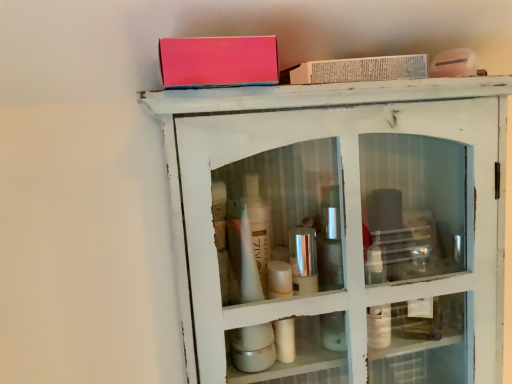
Question: In which direction should I rotate to look at matte pink box at upper center, which is the 2th book in back-to-front order?

Choices:
 (A) right
 (B) left

Answer: (B)

Question: Is matte pink box at upper center, which is the 2th book in back-to-front order, aimed at white distressed cabinet at upper center?

Choices:
 (A) yes
 (B) no

Answer: (B)

Question: Is matte pink box at upper center, which is the 2th book in back-to-front order, to the right of white distressed cabinet at upper center from the viewer's perspective?

Choices:
 (A) yes
 (B) no

Answer: (B)

Question: Is matte pink box at upper center, the 2th book viewed from the right, taller than white distressed cabinet at upper center?

Choices:
 (A) yes
 (B) no

Answer: (B)

Question: Is matte pink box at upper center, which is the 2th book in back-to-front order, wider than white distressed cabinet at upper center?

Choices:
 (A) no
 (B) yes

Answer: (A)

Question: Is matte pink box at upper center, positioned as the first book in front-to-back order, thinner than white distressed cabinet at upper center?

Choices:
 (A) no
 (B) yes

Answer: (B)

Question: Is matte pink box at upper center, positioned as the first book in front-to-back order, located outside white distressed cabinet at upper center?

Choices:
 (A) no
 (B) yes

Answer: (B)

Question: From the image's perspective, is white distressed cabinet at upper center beneath white paper book at upper center, positioned as the 2th book in front-to-back order?

Choices:
 (A) no
 (B) yes

Answer: (B)

Question: Can you confirm if white distressed cabinet at upper center is positioned to the left of white paper book at upper center, acting as the second book starting from the left?

Choices:
 (A) no
 (B) yes

Answer: (B)

Question: Is white distressed cabinet at upper center in front of white paper book at upper center, the 1th book viewed from the back?

Choices:
 (A) no
 (B) yes

Answer: (B)

Question: Is white distressed cabinet at upper center shorter than white paper book at upper center, acting as the second book starting from the left?

Choices:
 (A) no
 (B) yes

Answer: (A)

Question: From a real-world perspective, is white distressed cabinet at upper center physically below white paper book at upper center, the 1th book viewed from the back?

Choices:
 (A) no
 (B) yes

Answer: (B)

Question: Considering the relative sizes of white distressed cabinet at upper center and white paper book at upper center, the 1th book positioned from the right, in the image provided, is white distressed cabinet at upper center smaller than white paper book at upper center, the 1th book positioned from the right,?

Choices:
 (A) yes
 (B) no

Answer: (B)

Question: Is white distressed cabinet at upper center to the right of matte pink box at upper center, marked as the first book in a left-to-right arrangement, from the viewer's perspective?

Choices:
 (A) no
 (B) yes

Answer: (B)